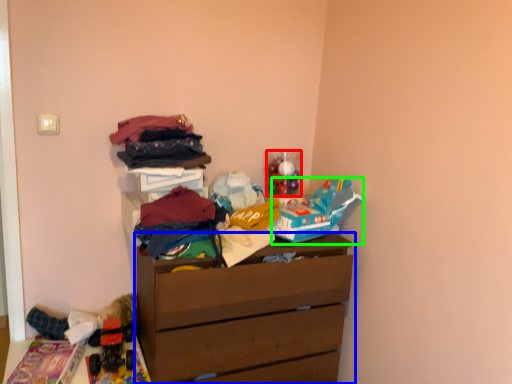
Question: Which object is the closest to the toy (highlighted by a red box)? Choose among these: chest of drawers (highlighted by a blue box) or toy (highlighted by a green box).

Choices:
 (A) chest of drawers
 (B) toy

Answer: (B)